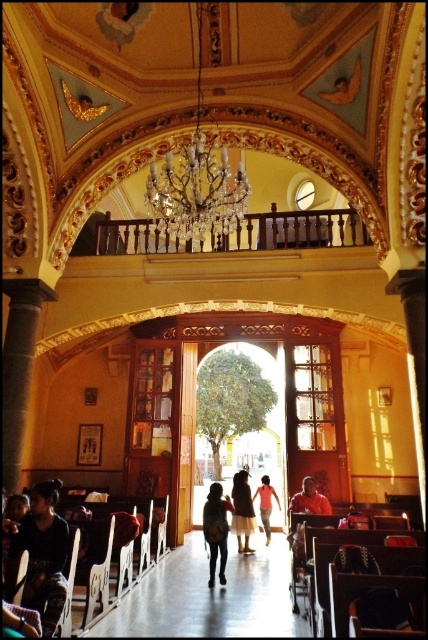
Is dark gray sweater at lower left bigger than light pink fabric dress at center?

Correct, dark gray sweater at lower left is larger in size than light pink fabric dress at center.

Is point (29, 600) closer to camera compared to point (267, 516)?

Yes, it is.

Find the location of `dark gray sweater at lower left`. dark gray sweater at lower left is located at coordinates (44, 554).

Does point (246, 228) lie in front of point (312, 512)?

No, it is behind (312, 512).

Does point (122, 252) come farther from viewer compared to point (324, 499)?

Yes, point (122, 252) is farther from viewer.

Find the location of a particular element. The height and width of the screenshot is (640, 428). wooden balustrade at upper center is located at coordinates tap(237, 234).

Who is more distant from viewer, (42, 580) or (226, 528)?

Point (226, 528)

From the picture: Can you confirm if dark gray sweater at lower left is positioned to the right of dark gray jeans at center?

Incorrect, dark gray sweater at lower left is not on the right side of dark gray jeans at center.

Identify the location of dark gray sweater at lower left. (44, 554).